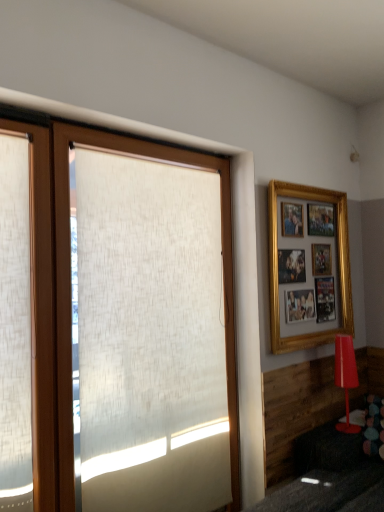
Question: Is gold/gilded picture frame at upper right wider or thinner than wooden shutter at left?

Choices:
 (A) thin
 (B) wide

Answer: (B)

Question: Considering the positions of gold/gilded picture frame at upper right and wooden shutter at left in the image, is gold/gilded picture frame at upper right bigger or smaller than wooden shutter at left?

Choices:
 (A) big
 (B) small

Answer: (A)

Question: Which of these objects is positioned closest to the matte red lamp at lower right?

Choices:
 (A) white textured roller blind at left
 (B) wooden shutter at left
 (C) gold/gilded picture frame at upper right

Answer: (C)

Question: Which of these objects is positioned farthest from the wooden shutter at left?

Choices:
 (A) white textured roller blind at left
 (B) matte red lamp at lower right
 (C) gold/gilded picture frame at upper right

Answer: (B)